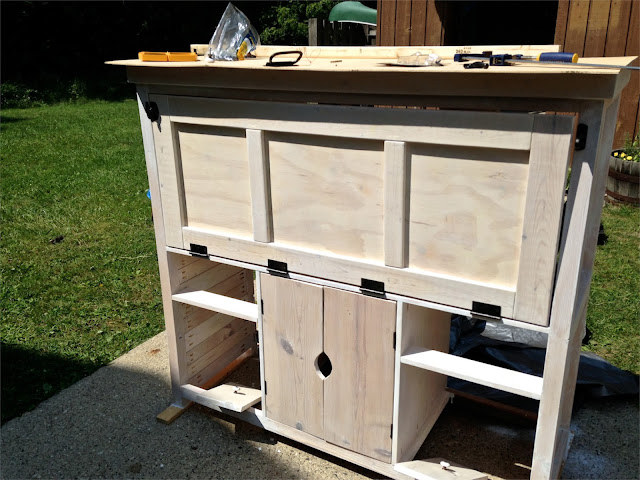
Identify the location of hinges. pyautogui.click(x=198, y=250), pyautogui.click(x=276, y=264), pyautogui.click(x=372, y=285), pyautogui.click(x=486, y=312).